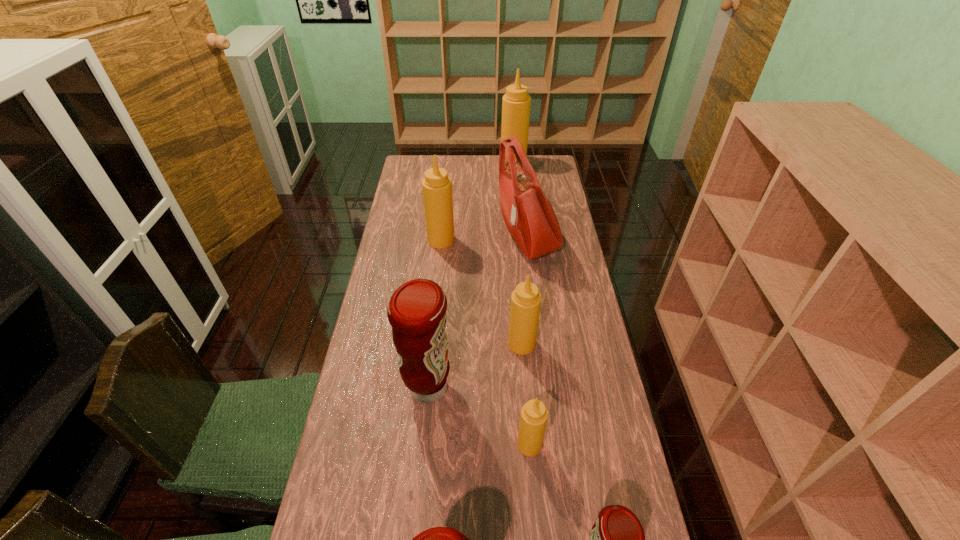
Select which object appears as the closest to the second smallest red condiment. Please provide its 2D coordinates. Your answer should be formatted as a tuple, i.e. [(x, y)], where the tuple contains the x and y coordinates of a point satisfying the conditions above.

[(617, 539)]

Select which object appears as the third closest to the fourth nearest condiment. Please provide its 2D coordinates. Your answer should be formatted as a tuple, i.e. [(x, y)], where the tuple contains the x and y coordinates of a point satisfying the conditions above.

[(440, 539)]

You are a GUI agent. You are given a task and a screenshot of the screen. Output one action in this format:
    pyautogui.click(x=<x>, y=<y>)
    Task: Click on the condiment that is the closest one to the farthest object
    The height and width of the screenshot is (540, 960).
    Given the screenshot: What is the action you would take?
    pyautogui.click(x=436, y=186)

Locate an element on the screen. The width and height of the screenshot is (960, 540). condiment that stands as the third closest to the red handbag is located at coordinates (516, 103).

Choose which tan condiment is the third nearest neighbor to the third nearest object. Please provide its 2D coordinates. Your answer should be formatted as a tuple, i.e. [(x, y)], where the tuple contains the x and y coordinates of a point satisfying the conditions above.

[(516, 103)]

Image resolution: width=960 pixels, height=540 pixels. Find the location of `tan condiment that is the second closest to the handbag`. tan condiment that is the second closest to the handbag is located at coordinates (525, 305).

Locate an element on the screen. The image size is (960, 540). red condiment that is the second closest one to the second smallest red condiment is located at coordinates (416, 311).

I want to click on red condiment that is the third closest one to the tallest condiment, so click(x=440, y=539).